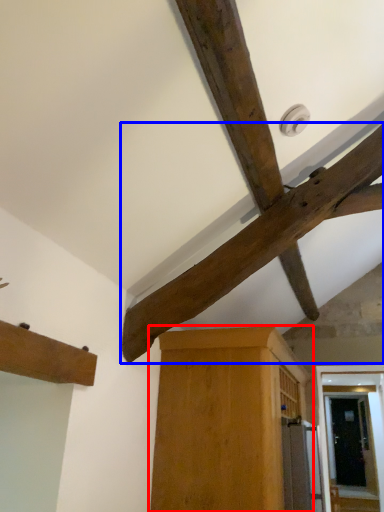
Question: Which point is further to the camera, cabinetry (highlighted by a red box) or beam (highlighted by a blue box)?

Choices:
 (A) cabinetry
 (B) beam

Answer: (A)